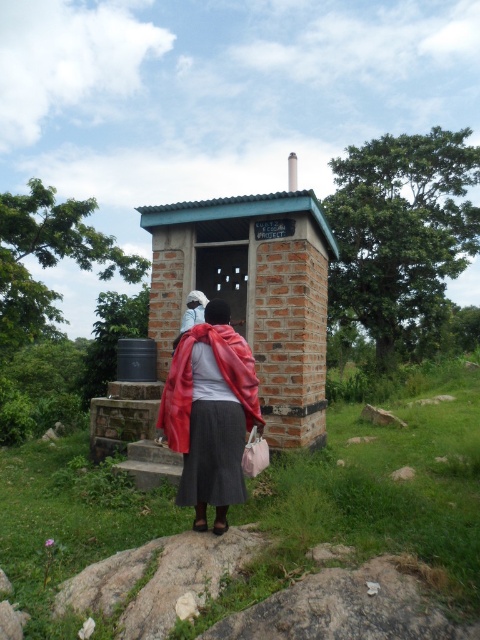
Question: Which object appears farthest from the camera in this image?

Choices:
 (A) matte red jacket at center
 (B) brick/rough hut at center

Answer: (B)

Question: Which point is farther to the camera?

Choices:
 (A) matte red jacket at center
 (B) brick/rough hut at center

Answer: (B)

Question: Observing the image, what is the correct spatial positioning of brick/rough hut at center in reference to matte red jacket at center?

Choices:
 (A) left
 (B) right

Answer: (A)

Question: Can you confirm if brick/rough hut at center is wider than matte red jacket at center?

Choices:
 (A) yes
 (B) no

Answer: (A)

Question: Is brick/rough hut at center above matte red jacket at center?

Choices:
 (A) no
 (B) yes

Answer: (B)